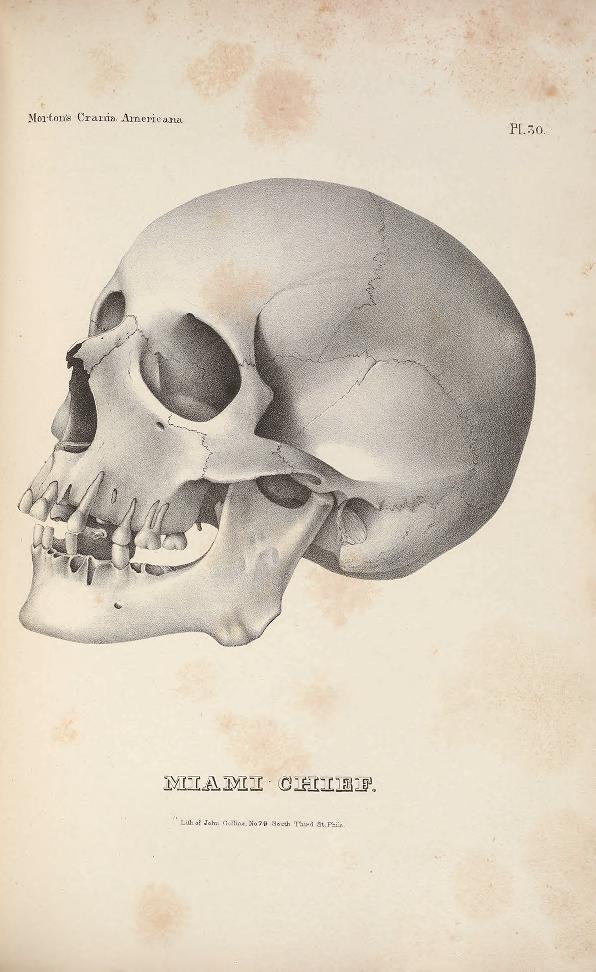
You are a GUI agent. You are given a task and a screenshot of the screen. Output one action in this format:
    pyautogui.click(x=<x>, y=<y>)
    Task: Click on the weathered poster
    This screenshot has height=972, width=596.
    Given the screenshot: What is the action you would take?
    pyautogui.click(x=457, y=813)